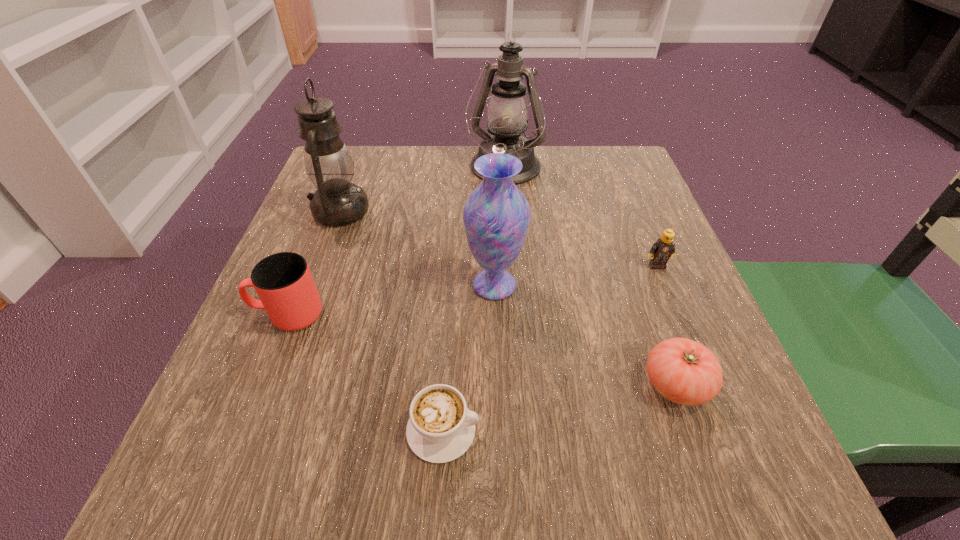
Where is `vacant area in the image that satisfies the following two spatial constraints: 1. on the back side of the right oil lamp; 2. on the right side of the left oil lamp`? The height and width of the screenshot is (540, 960). vacant area in the image that satisfies the following two spatial constraints: 1. on the back side of the right oil lamp; 2. on the right side of the left oil lamp is located at coordinates (356, 169).

Find the location of `free point that satisfies the following two spatial constraints: 1. on the handle side of the right oil lamp; 2. on the right side of the cup`. free point that satisfies the following two spatial constraints: 1. on the handle side of the right oil lamp; 2. on the right side of the cup is located at coordinates (347, 169).

What are the coordinates of `free space that satisfies the following two spatial constraints: 1. on the handle side of the cup; 2. on the right side of the vase` in the screenshot? It's located at (300, 285).